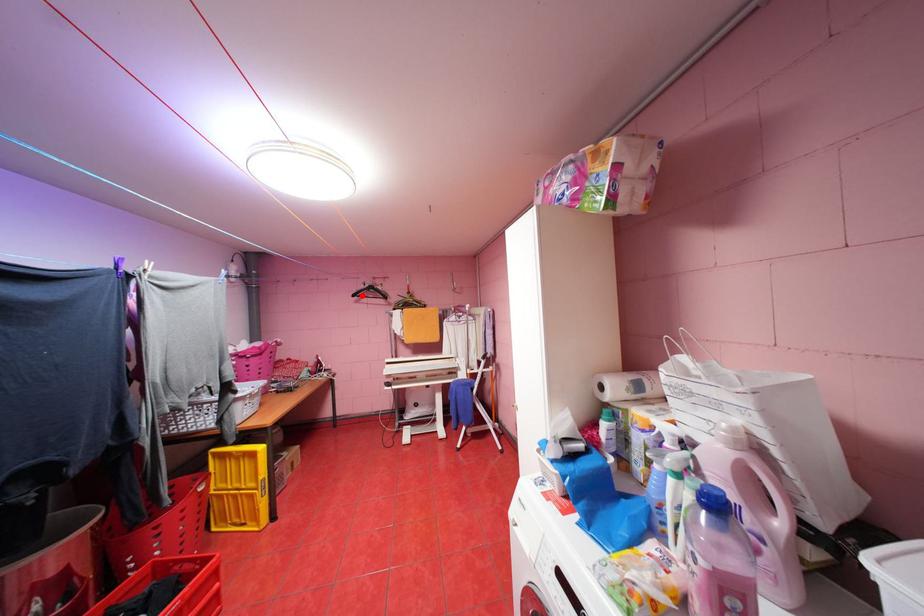
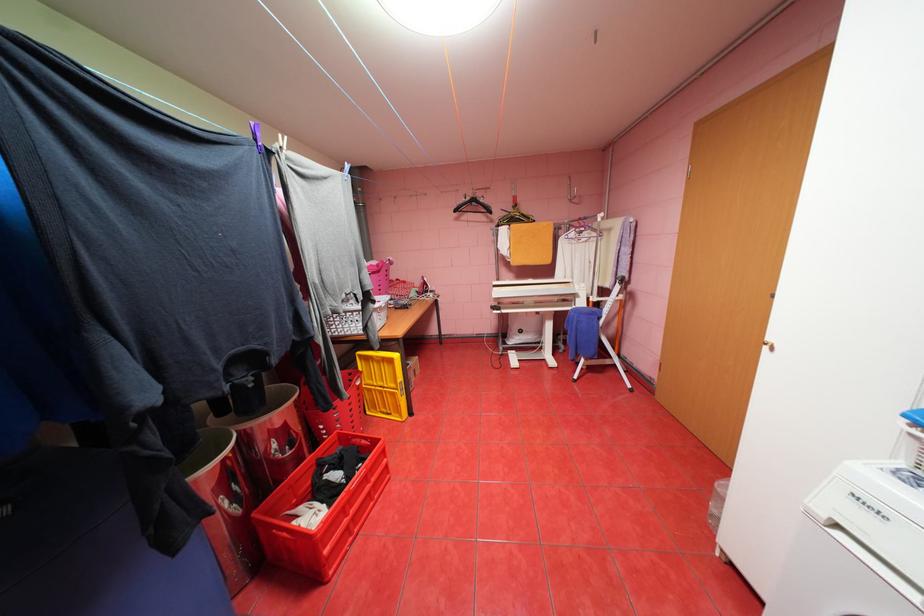
Question: I am providing you with two images of the same scene from different viewpoints. A red point is marked on the first image. Can you still see the location of the red point in image 2?

Choices:
 (A) Yes
 (B) No

Answer: (A)